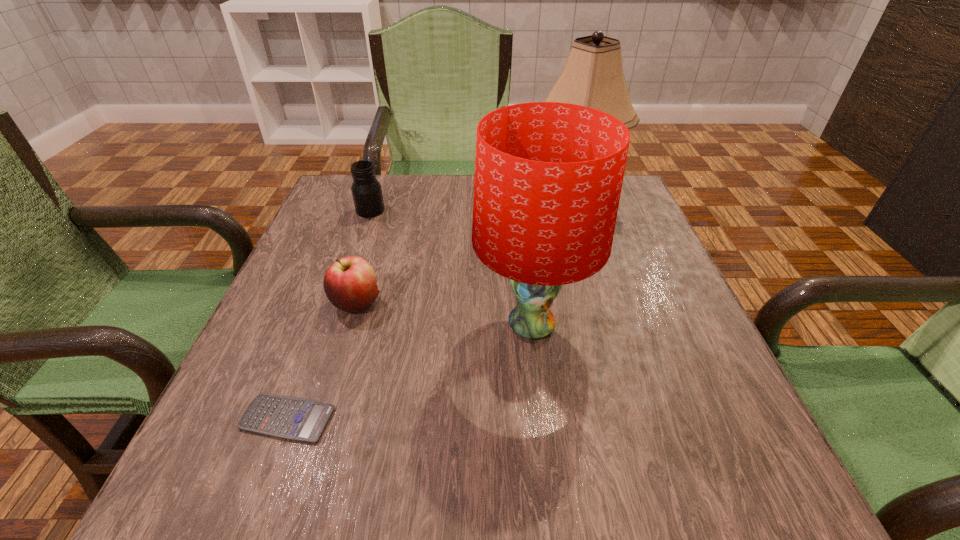
Where is `free location located 0.380m on the right of the jar`? The height and width of the screenshot is (540, 960). free location located 0.380m on the right of the jar is located at coordinates [x=532, y=211].

You are a GUI agent. You are given a task and a screenshot of the screen. Output one action in this format:
    pyautogui.click(x=<x>, y=<y>)
    Task: Click on the vacant space located 0.360m on the right of the apple
    This screenshot has width=960, height=540.
    Given the screenshot: What is the action you would take?
    (562, 303)

Locate an element on the screen. free space located 0.050m on the right of the nearest object is located at coordinates (365, 418).

I want to click on lamp present at the far edge, so click(592, 76).

In order to click on jar that is at the far edge in this screenshot , I will do `click(366, 190)`.

Identify the location of jar present at the left edge. The image size is (960, 540). (366, 190).

Locate an element on the screen. This screenshot has width=960, height=540. apple that is positioned at the left edge is located at coordinates (349, 283).

This screenshot has width=960, height=540. Identify the location of calculator present at the left edge. (291, 418).

Where is `object present at the right edge`? The image size is (960, 540). object present at the right edge is located at coordinates (592, 76).

Where is `object positioned at the far left corner`? This screenshot has width=960, height=540. object positioned at the far left corner is located at coordinates (366, 190).